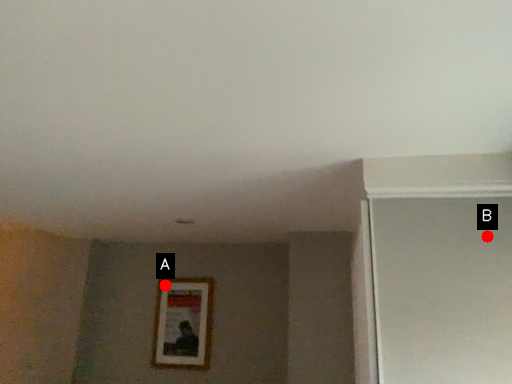
Question: Two points are circled on the image, labeled by A and B beside each circle. Which point appears closest to the camera in this image?

Choices:
 (A) A is closer
 (B) B is closer

Answer: (B)